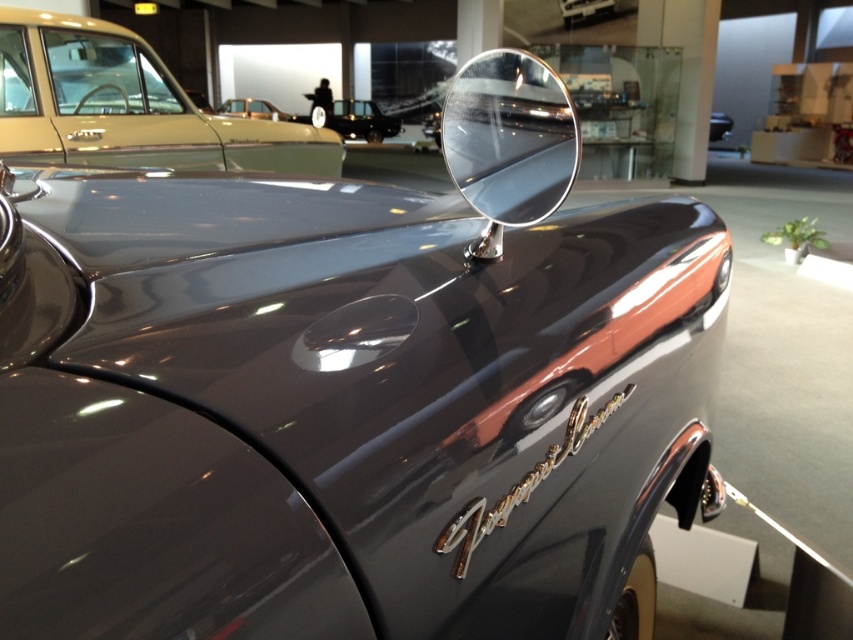
Question: From the image, what is the correct spatial relationship of silver/metallic view mirror at upper center in relation to shiny black car at center?

Choices:
 (A) right
 (B) left

Answer: (A)

Question: Which object is closer to the camera taking this photo?

Choices:
 (A) shiny black car at center
 (B) silver/metallic view mirror at upper center
 (C) gold metallic car at upper center
 (D) shiny gold car at upper left

Answer: (B)

Question: Among these objects, which one is nearest to the camera?

Choices:
 (A) silver/metallic view mirror at upper center
 (B) shiny black car at center
 (C) gold metallic car at upper center
 (D) shiny gold car at upper left

Answer: (A)

Question: Which of the following is the farthest from the observer?

Choices:
 (A) 347,131
 (B) 486,76
 (C) 311,161
 (D) 241,113

Answer: (A)

Question: Does shiny gold car at upper left appear on the left side of shiny black car at center?

Choices:
 (A) no
 (B) yes

Answer: (A)

Question: Can you confirm if shiny black car at center is positioned below gold metallic car at upper center?

Choices:
 (A) yes
 (B) no

Answer: (B)